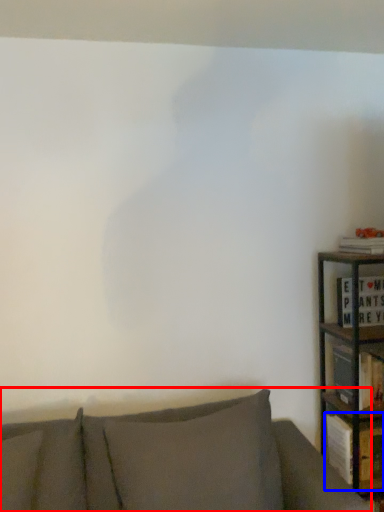
Question: Which object appears farthest to the camera in this image, studio couch (highlighted by a red box) or book (highlighted by a blue box)?

Choices:
 (A) studio couch
 (B) book

Answer: (B)